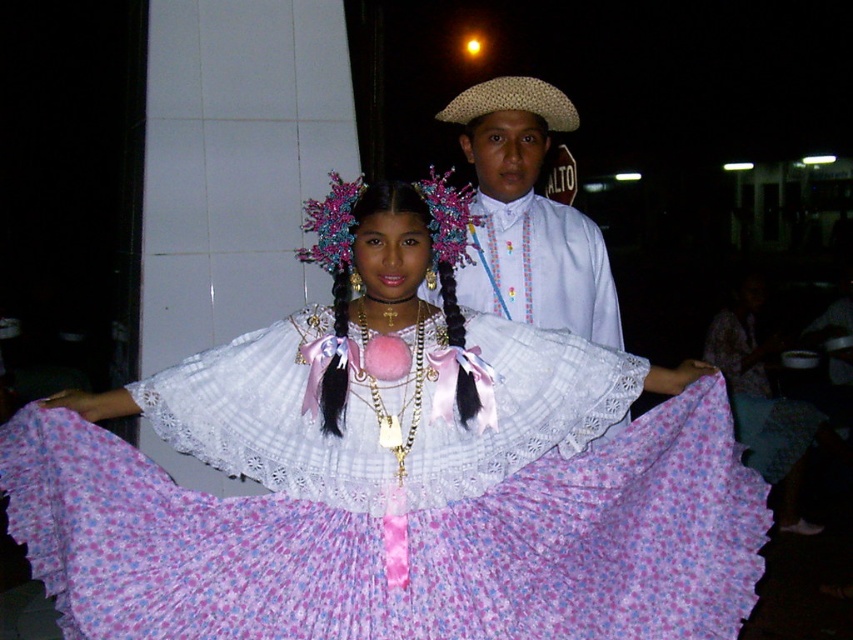
Question: Is floral chiffon dress at center thinner than natural straw hat at center?

Choices:
 (A) yes
 (B) no

Answer: (B)

Question: Which of these objects is positioned closest to the natural straw hat at center?

Choices:
 (A) white woven hat at center
 (B) pink fabric floral crown at center

Answer: (A)

Question: Among these objects, which one is farthest from the camera?

Choices:
 (A) pink fabric floral crown at center
 (B) floral chiffon dress at center
 (C) white woven hat at center

Answer: (C)

Question: Observing the image, what is the correct spatial positioning of white woven hat at center in reference to pink fabric floral crown at center?

Choices:
 (A) left
 (B) right

Answer: (B)

Question: Is the position of floral chiffon dress at center more distant than that of natural straw hat at center?

Choices:
 (A) yes
 (B) no

Answer: (B)

Question: Which object is positioned closest to the natural straw hat at center?

Choices:
 (A) floral chiffon dress at center
 (B) white woven hat at center
 (C) pink fabric floral crown at center

Answer: (B)